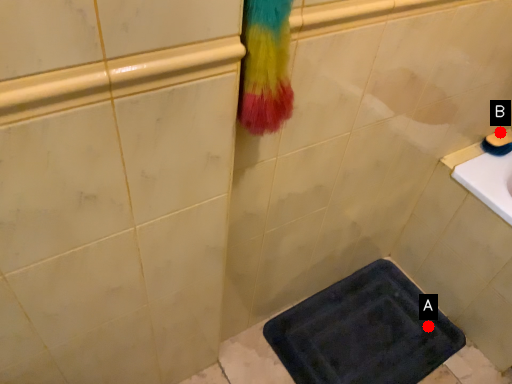
Question: Two points are circled on the image, labeled by A and B beside each circle. Which point is farther from the camera taking this photo?

Choices:
 (A) A is further
 (B) B is further

Answer: (A)